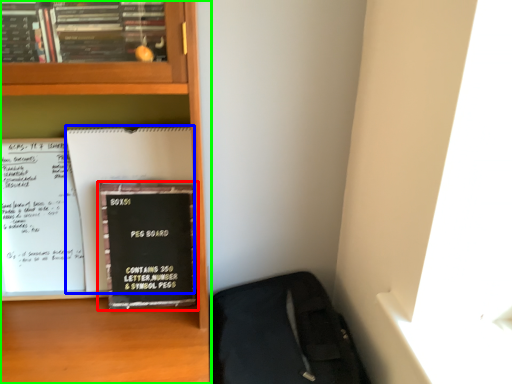
Question: Which is nearer to the book (highlighted by a red box)? paperback book (highlighted by a blue box) or bookcase (highlighted by a green box).

Choices:
 (A) paperback book
 (B) bookcase

Answer: (A)